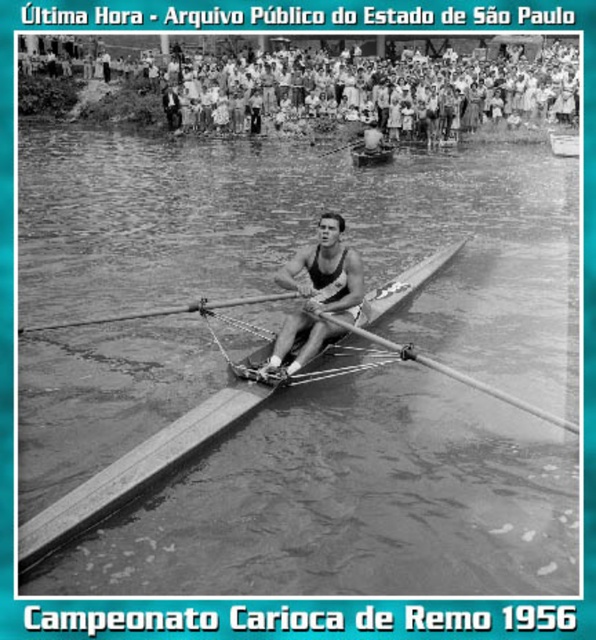
Question: Does wooden canoe at center appear on the left side of smooth wood boat at center?

Choices:
 (A) yes
 (B) no

Answer: (A)

Question: Considering the real-world distances, which object is closest to the clear water at center?

Choices:
 (A) wooden paddle at center
 (B) smooth wood boat at center

Answer: (A)

Question: Which point is closer to the camera?

Choices:
 (A) pos(372,148)
 (B) pos(23,449)
 (C) pos(100,100)
 (D) pos(311,339)

Answer: (B)

Question: Which point is closer to the camera?

Choices:
 (A) wooden paddle at center
 (B) wooden boat at center

Answer: (A)

Question: Can you confirm if smooth skin man at center is positioned to the left of wooden smooth oar at center?

Choices:
 (A) yes
 (B) no

Answer: (A)

Question: Is wooden boat at center thinner than smooth wood boat at center?

Choices:
 (A) yes
 (B) no

Answer: (B)